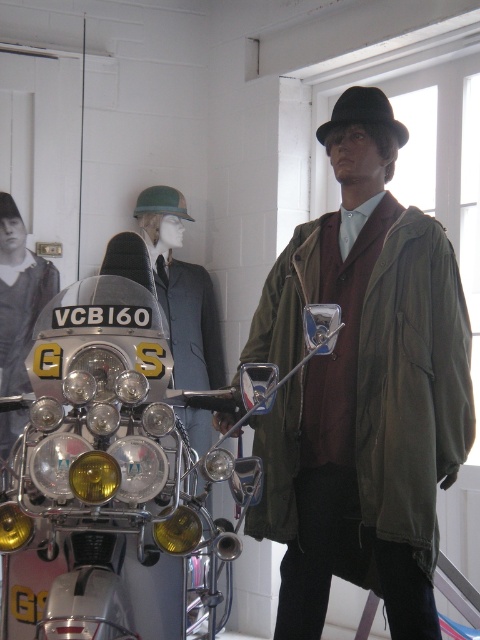
You are a photographer setting up a shoot in the museum. You have a camera that can only focus on objects taller than 1.5 meters. You see the shiny chrome motorcycle at center and the matte black jacket at center. Which object will your camera focus on?

The shiny chrome motorcycle at center has a greater height compared to the matte black jacket at center. Since the motorcycle is taller, the camera will focus on it.

In the scene shown: You are a security guard in the museum and need to determine if the shiny chrome motorcycle at center can fit through a doorway that is exactly the height of the black felt fedora at upper center. Can it pass through?

The shiny chrome motorcycle at center is taller than the black felt fedora at upper center. Therefore, it cannot pass through the doorway since the motorcycle exceeds the doorway height.

From the picture: You are a tour guide leading a group through the museum. You need to ensure that visitors can comfortably walk between the shiny chrome motorcycle at center and the black felt fedora at upper center. The minimum required distance for a walkway between two exhibits is 6 feet. Can visitors comfortably walk between these two exhibits?

The shiny chrome motorcycle at center and the black felt fedora at upper center are 7.28 feet apart from each other. Since the required distance is 6 feet, visitors can comfortably walk between them as the current spacing exceeds the minimum requirement.